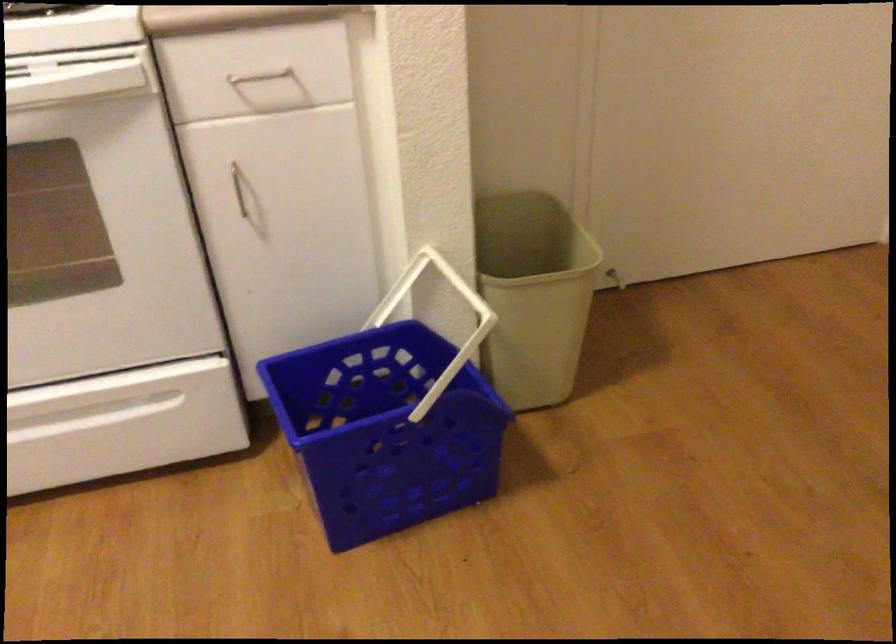
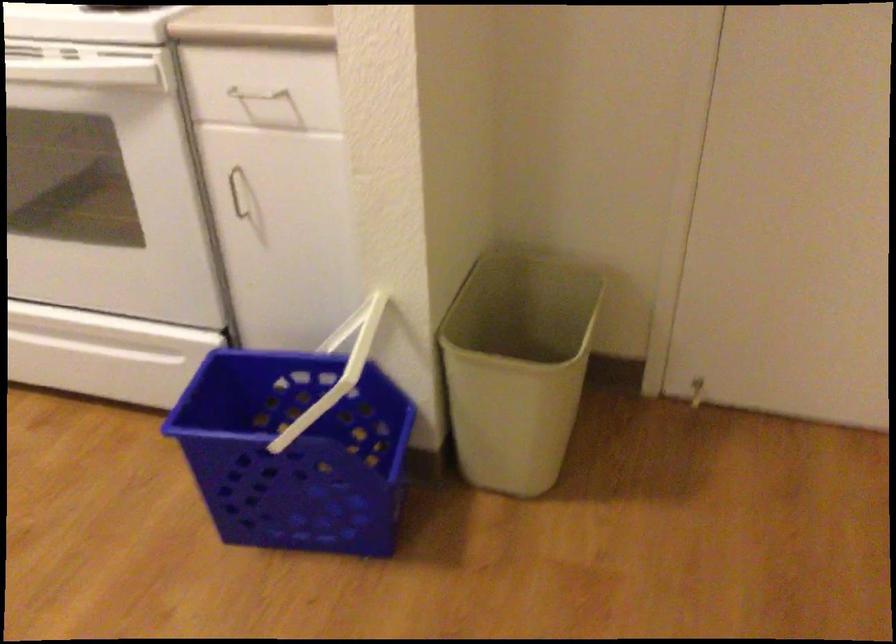
The point at [248,80] is marked in the first image. Where is the corresponding point in the second image?

(253, 98)